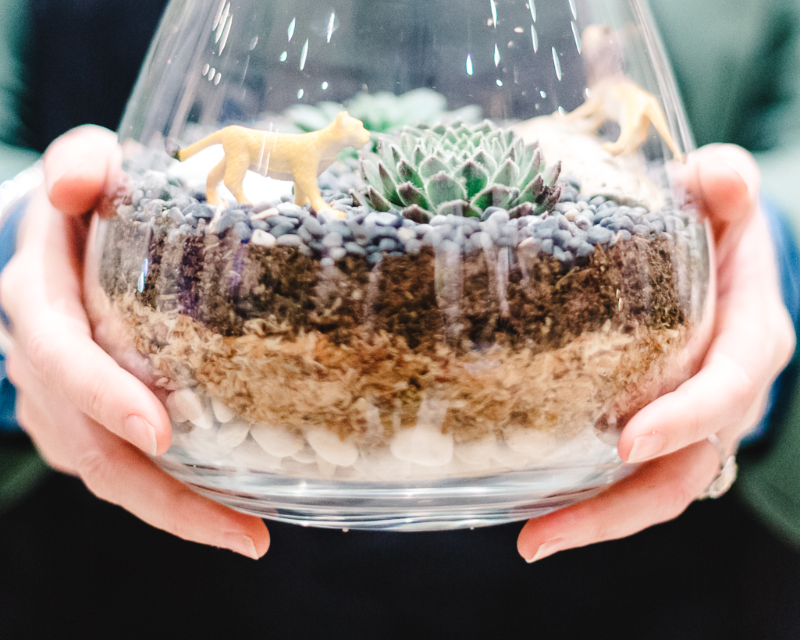
Where is `vase`? This screenshot has height=640, width=800. vase is located at coordinates (634, 157).